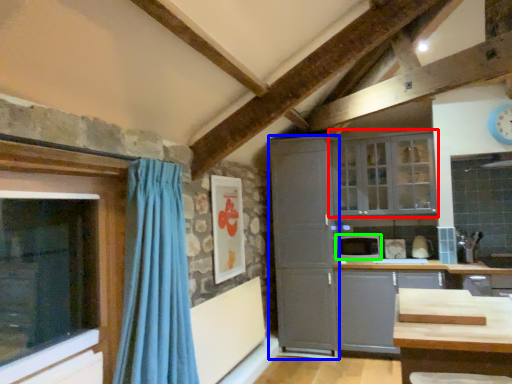
Question: Estimate the real-world distances between objects in this image. Which object is farther from window (highlighted by a red box), cabinetry (highlighted by a blue box) or appliance (highlighted by a green box)?

Choices:
 (A) cabinetry
 (B) appliance

Answer: (B)